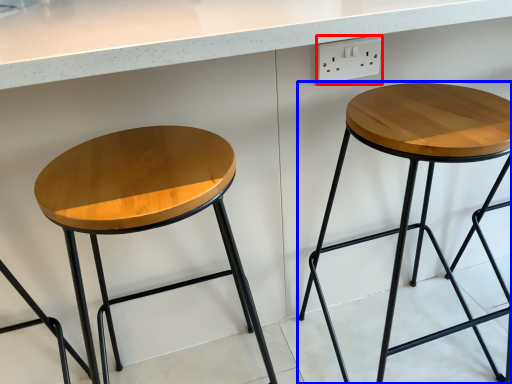
Question: Among these objects, which one is farthest to the camera, electric outlet (highlighted by a red box) or stool (highlighted by a blue box)?

Choices:
 (A) electric outlet
 (B) stool

Answer: (A)